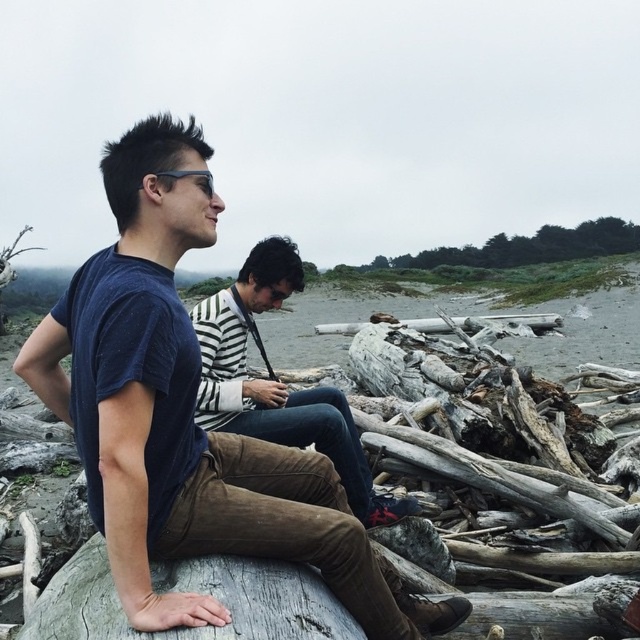
You are standing at the point marked as point [170,627] and want to walk directly to the viewer. How far will you have to walk in feet?

You will have to walk 6.08 feet to reach the viewer from point [170,627].